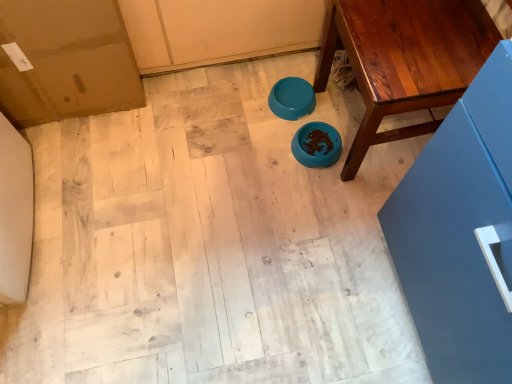
Identify the location of vacant space underneath blue matte bowl at center, marked as the 1th bowl in a bottom-to-top arrangement (from a real-world perspective). The height and width of the screenshot is (384, 512). point(309,145).